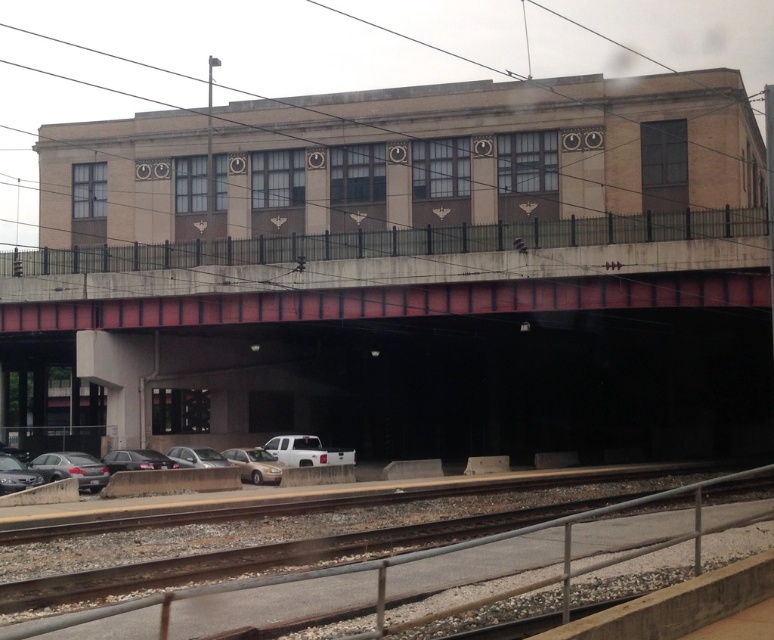
You are driving a silver metallic truck at lower center and want to pass under the concrete bridge at center. Can you safely do so without hitting the bridge?

The concrete bridge at center has a greater height compared to the silver metallic truck at lower center, so yes, you can safely pass under the concrete bridge at center without hitting it.

You are standing on the pedestrian bridge looking towards the beige concrete building at upper center and the white matte truck at lower center. Which object is positioned to the left of the other?

The beige concrete building at upper center is positioned to the left of the white matte truck at lower center.